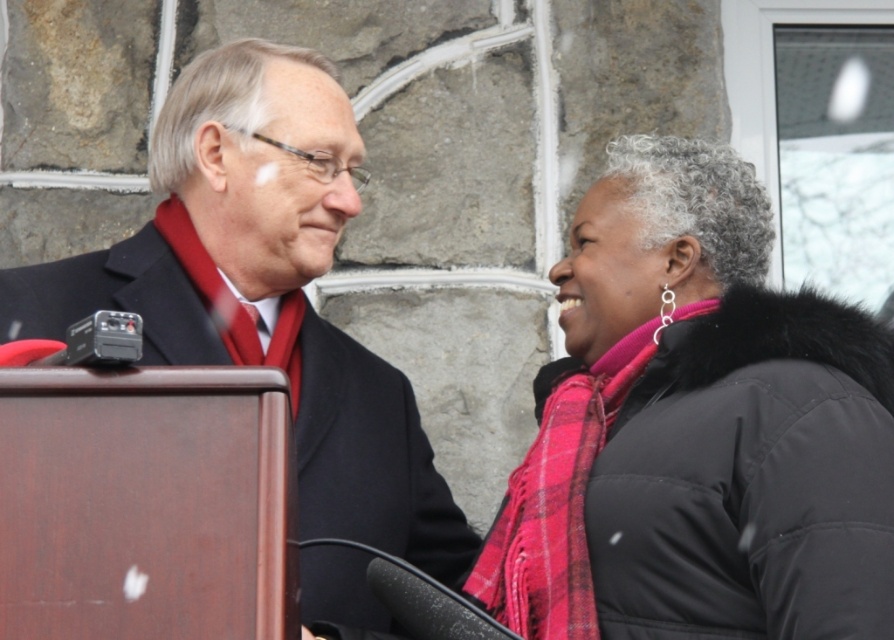
Who is positioned more to the right, pink plaid scarf at right or matte black suit at center?

From the viewer's perspective, pink plaid scarf at right appears more on the right side.

Can you confirm if pink plaid scarf at right is smaller than matte black suit at center?

No, pink plaid scarf at right is not smaller than matte black suit at center.

What are the coordinates of `pink plaid scarf at right` in the screenshot? It's located at (696, 429).

Is matte black suit at center below plaid wool scarf at right?

A: Actually, matte black suit at center is above plaid wool scarf at right.

Does point (364, 426) come closer to viewer compared to point (541, 484)?

No, (364, 426) is further to viewer.

Does point (241, 326) come closer to viewer compared to point (515, 557)?

No.

Locate an element on the screen. matte black suit at center is located at coordinates (266, 289).

Between pink plaid scarf at right and plaid wool scarf at right, which one appears on the right side from the viewer's perspective?

pink plaid scarf at right is more to the right.

Is pink plaid scarf at right closer to camera compared to plaid wool scarf at right?

Yes, pink plaid scarf at right is in front of plaid wool scarf at right.

Is point (580, 499) positioned behind point (578, 372)?

No, (580, 499) is closer to viewer.

Find the location of `pink plaid scarf at right`. pink plaid scarf at right is located at coordinates (696, 429).